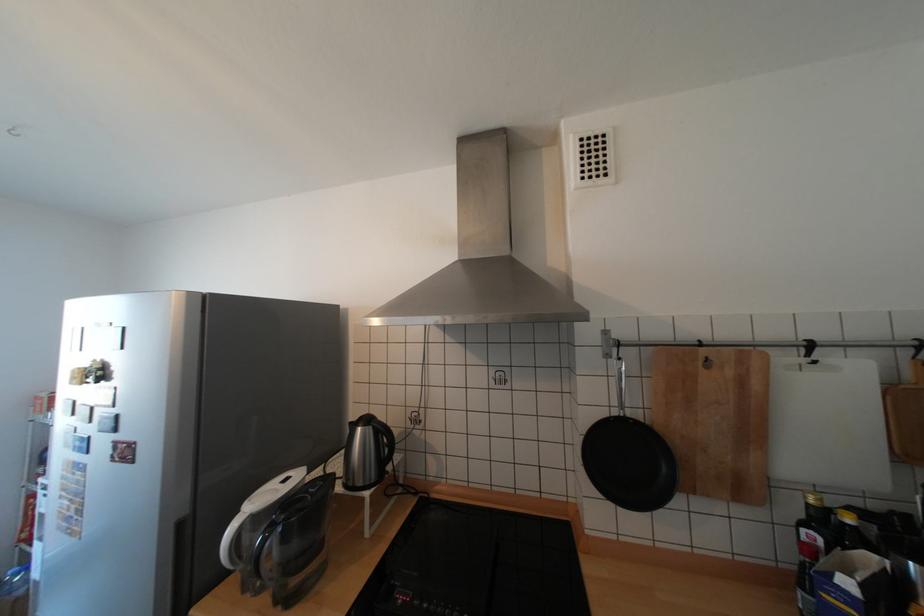
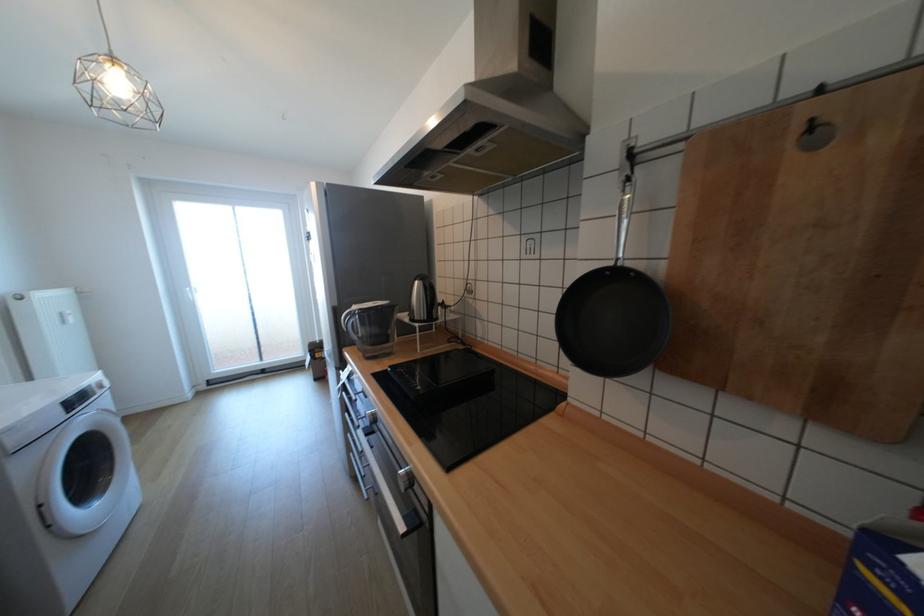
Question: The first image is from the beginning of the video and the second image is from the end. How did the camera likely rotate when shooting the video?

Choices:
 (A) Left
 (B) Right
 (C) Up
 (D) Down

Answer: (A)